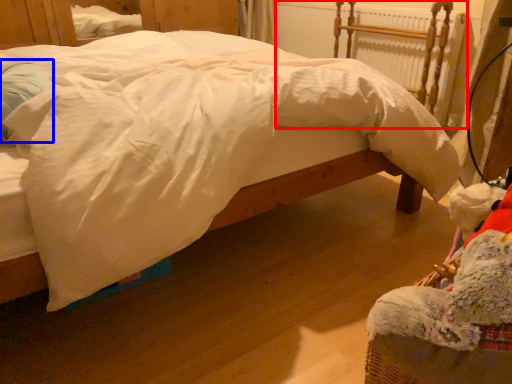
Question: Which point is further to the camera, radiator (highlighted by a red box) or pillow (highlighted by a blue box)?

Choices:
 (A) radiator
 (B) pillow

Answer: (A)